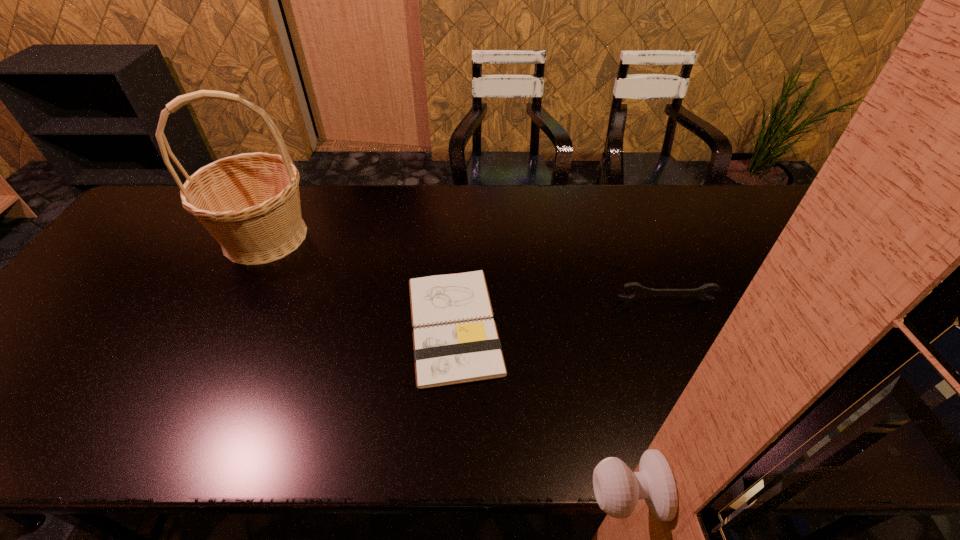
Identify the location of vacant space at the far edge of the desktop. (625, 189).

This screenshot has height=540, width=960. I want to click on vacant area at the near edge of the desktop, so click(72, 424).

In the image, there is a desktop. At what (x,y) coordinates should I click in order to perform the action: click on vacant space at the left edge. Please return your answer as a coordinate pair (x, y). Looking at the image, I should click on (115, 288).

At what (x,y) coordinates should I click in order to perform the action: click on free spot at the right edge of the desktop. Please return your answer as a coordinate pair (x, y). This screenshot has height=540, width=960. Looking at the image, I should click on (840, 286).

I want to click on vacant space at the far right corner of the desktop, so click(x=800, y=209).

Identify the location of vacant area that lies between the leftmost object and the notepad. (360, 281).

I want to click on vacant space that's between the second object from left to right and the second shortest object, so click(560, 313).

The height and width of the screenshot is (540, 960). What are the coordinates of `vacant area that lies between the wrench and the leftmost object` in the screenshot? It's located at (466, 269).

Where is `vacant area that lies between the basket and the notepad`? The image size is (960, 540). vacant area that lies between the basket and the notepad is located at coordinates (360, 281).

This screenshot has width=960, height=540. I want to click on object that stands as the second closest to the farthest object, so click(641, 292).